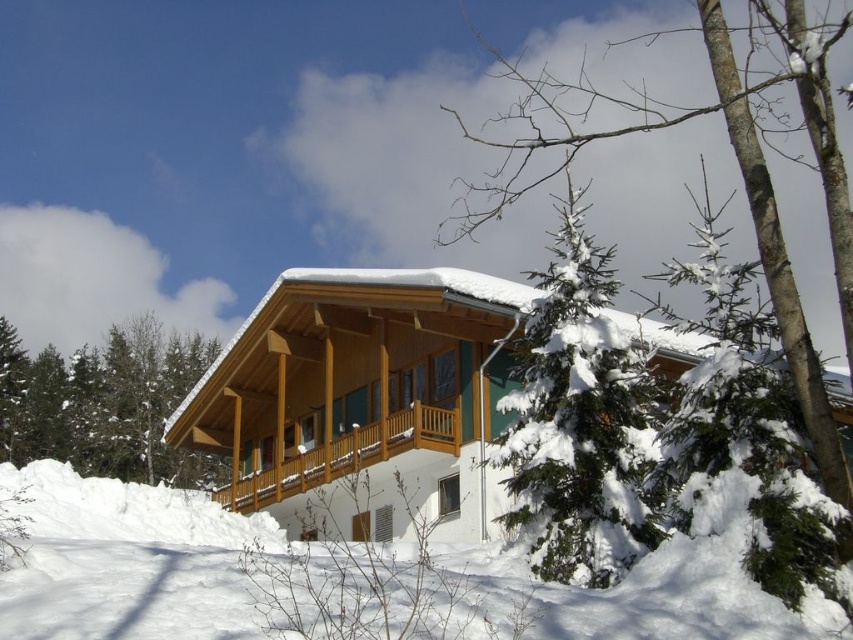
You are standing in the snowy landscape and want to reach the wooden cabin at center from the green textured pine tree at lower left. Which direction should you move relative to the pine tree?

You should move away from the green textured pine tree at lower left towards the wooden cabin at center since the cabin is positioned over the pine tree, indicating it is further ahead in that direction.

You are standing in front of the chalet and want to walk towards the green textured pine tree at lower left. Will you first step on the white fluffy snow at lower center before reaching the pine tree?

Yes, since the white fluffy snow at lower center is closer to the viewer than the green textured pine tree at lower left, you will step on the white fluffy snow at lower center first before reaching the pine tree.

You are standing in front of the chalet and notice the white fluffy snow at lower center and the green textured pine tree at lower left. Which object is taller?

The white fluffy snow at lower center is not as tall as the green textured pine tree at lower left, so the green textured pine tree at lower left is taller.